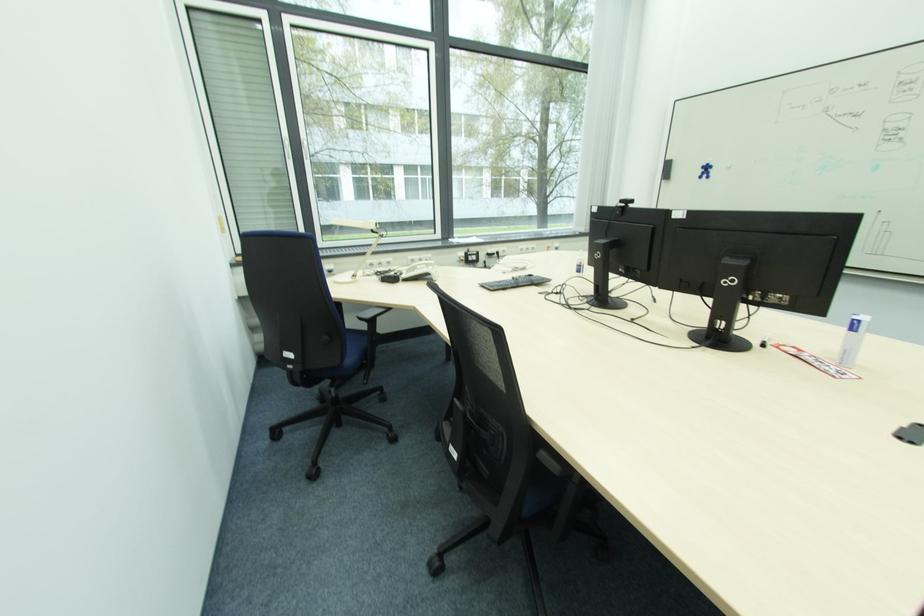
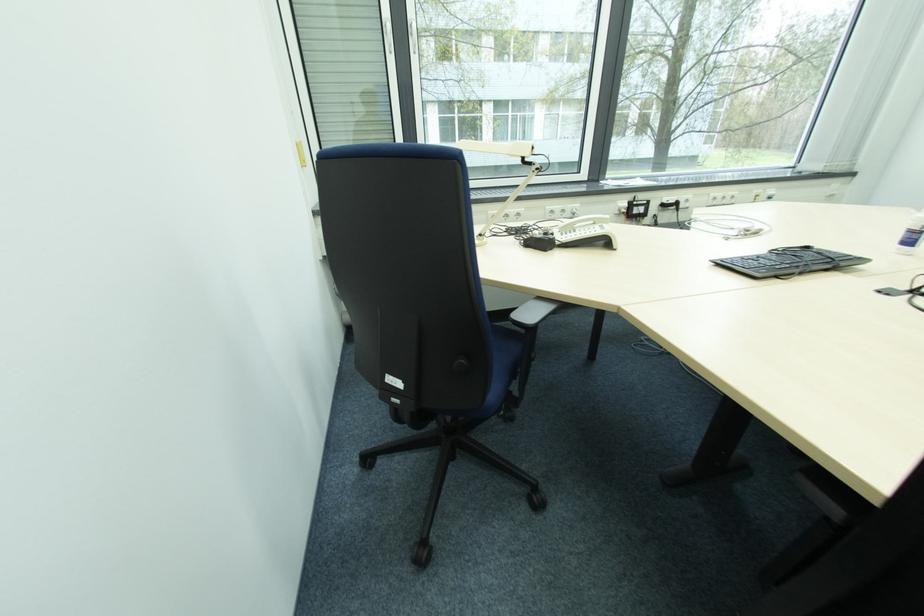
Question: The images are taken continuously from a first-person perspective. In which direction is your viewpoint rotating?

Choices:
 (A) Left
 (B) Right
 (C) Up
 (D) Down

Answer: (A)